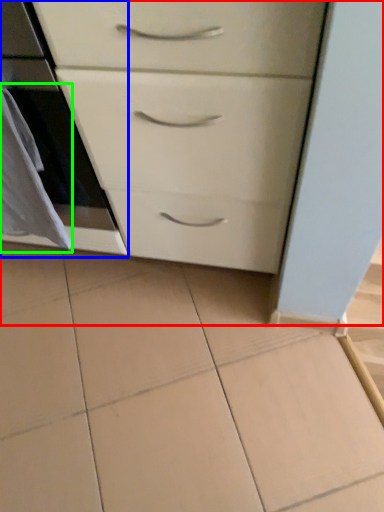
Question: Which object is the farthest from chest of drawers (highlighted by a red box)? Choose among these: oven (highlighted by a blue box) or material (highlighted by a green box).

Choices:
 (A) oven
 (B) material

Answer: (B)